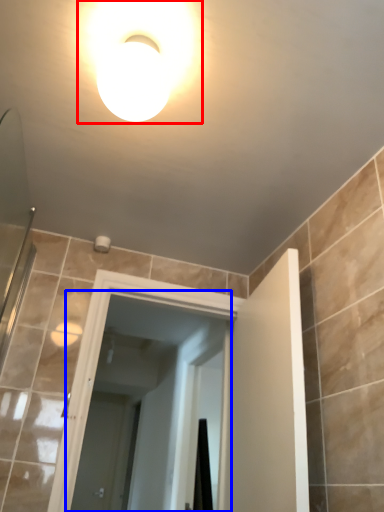
Question: Which object is further to the camera taking this photo, light fixture (highlighted by a red box) or screen door (highlighted by a blue box)?

Choices:
 (A) light fixture
 (B) screen door

Answer: (B)